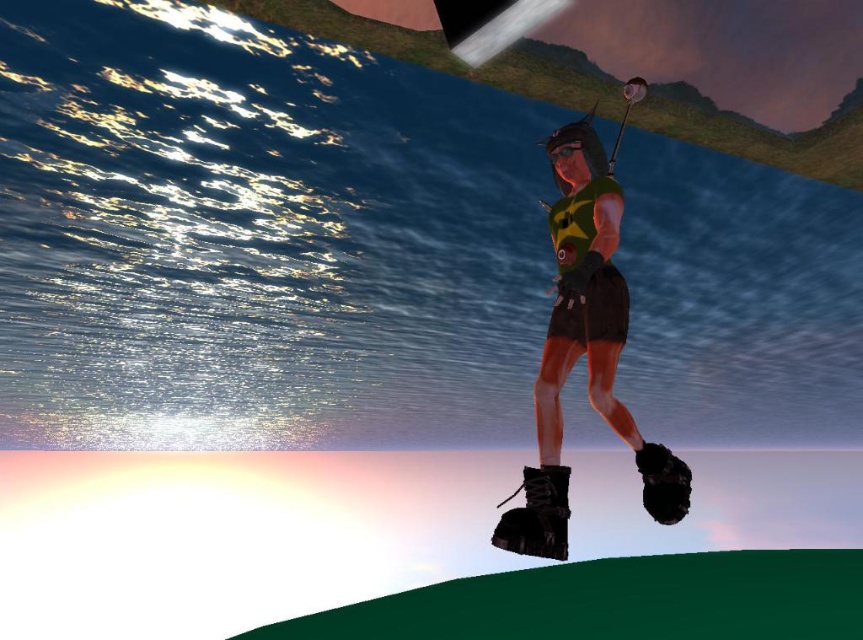
Question: Is shiny black boots at center below black leather baseball glove at lower right?

Choices:
 (A) yes
 (B) no

Answer: (B)

Question: Does shiny black boots at center appear over black leather baseball glove at lower right?

Choices:
 (A) no
 (B) yes

Answer: (B)

Question: Is shiny black boots at center further to camera compared to black leather baseball glove at lower right?

Choices:
 (A) no
 (B) yes

Answer: (A)

Question: Among these points, which one is nearest to the camera?

Choices:
 (A) (644, 451)
 (B) (586, 252)

Answer: (B)